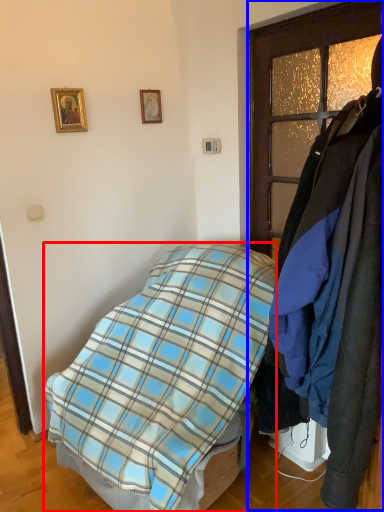
Question: Which of the following is the farthest to the observer, bed (highlighted by a red box) or closet (highlighted by a blue box)?

Choices:
 (A) bed
 (B) closet

Answer: (A)